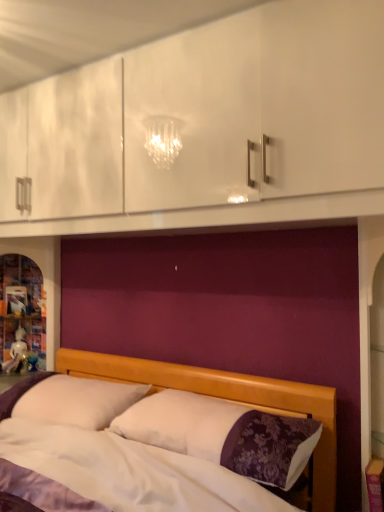
Describe the element at coordinates (78, 401) in the screenshot. I see `white soft pillow at lower left` at that location.

What are the coordinates of `white soft pillow at lower left` in the screenshot? It's located at (78, 401).

Looking at this image, in order to face wooden bed at center, should I rotate leftwards or rightwards?

A 12.408 degree turn to the left will do.

This screenshot has width=384, height=512. Find the location of `wooden bed at center`. wooden bed at center is located at coordinates (226, 399).

What is the approximate height of wooden bed at center?

The height of wooden bed at center is 20.42 inches.

This screenshot has height=512, width=384. Describe the element at coordinates (226, 399) in the screenshot. I see `wooden bed at center` at that location.

I want to click on white soft pillow at lower left, so click(x=78, y=401).

Which is more to the right, white soft pillow at lower left or wooden bed at center?

Positioned to the right is wooden bed at center.

Is the position of white soft pillow at lower left less distant than that of wooden bed at center?

No, the depth of white soft pillow at lower left is greater than that of wooden bed at center.

Is point (72, 393) in front of point (324, 482)?

No.

From the image's perspective, which object appears higher, white soft pillow at lower left or wooden bed at center?

white soft pillow at lower left.

From a real-world perspective, is white soft pillow at lower left physically located above or below wooden bed at center?

From a real-world perspective, white soft pillow at lower left is physically above wooden bed at center.

Which of these two, white soft pillow at lower left or wooden bed at center, is thinner?

With smaller width is white soft pillow at lower left.

Which of these two, white soft pillow at lower left or wooden bed at center, stands taller?

wooden bed at center is taller.

Between white soft pillow at lower left and wooden bed at center, which one has larger size?

wooden bed at center.

Would you say white soft pillow at lower left is inside or outside wooden bed at center?

white soft pillow at lower left lies within the bounds of wooden bed at center.

Is white soft pillow at lower left positioned far away from wooden bed at center?

white soft pillow at lower left is near wooden bed at center, not far away.

Is white soft pillow at lower left turned away from wooden bed at center?

Yes, white soft pillow at lower left's orientation is away from wooden bed at center.

How far apart are white soft pillow at lower left and wooden bed at center?

white soft pillow at lower left is 12.75 inches from wooden bed at center.

What are the coordinates of `pillow that appears behind the wooden bed at center` in the screenshot? It's located at (78, 401).

Based on their positions, is wooden bed at center located to the left or right of white soft pillow at lower left?

From the image, it's evident that wooden bed at center is to the right of white soft pillow at lower left.

Does wooden bed at center lie behind white soft pillow at lower left?

No, wooden bed at center is in front of white soft pillow at lower left.

Is point (117, 362) less distant than point (79, 420)?

No, (117, 362) is further to viewer.

From the image's perspective, which is below, wooden bed at center or white soft pillow at lower left?

wooden bed at center is shown below in the image.

In the scene shown: From a real-world perspective, between wooden bed at center and white soft pillow at lower left, who is vertically higher?

white soft pillow at lower left, from a real-world perspective.

Is wooden bed at center thinner than white soft pillow at lower left?

Incorrect, the width of wooden bed at center is not less than that of white soft pillow at lower left.

Considering the sizes of objects wooden bed at center and white soft pillow at lower left in the image provided, who is taller, wooden bed at center or white soft pillow at lower left?

wooden bed at center.

Which of these two, wooden bed at center or white soft pillow at lower left, is bigger?

Bigger between the two is wooden bed at center.

Is wooden bed at center inside or outside of white soft pillow at lower left?

The correct answer is: outside.

Does wooden bed at center touch white soft pillow at lower left?

wooden bed at center and white soft pillow at lower left are not in contact.

Does wooden bed at center turn towards white soft pillow at lower left?

Yes, wooden bed at center is facing white soft pillow at lower left.

How different are the orientations of wooden bed at center and white soft pillow at lower left in degrees?

There is a 0.331-degree angle between the facing directions of wooden bed at center and white soft pillow at lower left.

Find the location of a particular element. The height and width of the screenshot is (512, 384). bed that appears below the white soft pillow at lower left (from the image's perspective) is located at coordinates click(x=226, y=399).

Where is `pillow that is above the wooden bed at center (from the image's perspective)`? pillow that is above the wooden bed at center (from the image's perspective) is located at coordinates (78, 401).

You are a GUI agent. You are given a task and a screenshot of the screen. Output one action in this format:
    pyautogui.click(x=<x>, y=<y>)
    Task: Click on the bed that is under the white soft pillow at lower left (from a real-world perspective)
    Image resolution: width=384 pixels, height=512 pixels.
    Given the screenshot: What is the action you would take?
    pyautogui.click(x=226, y=399)